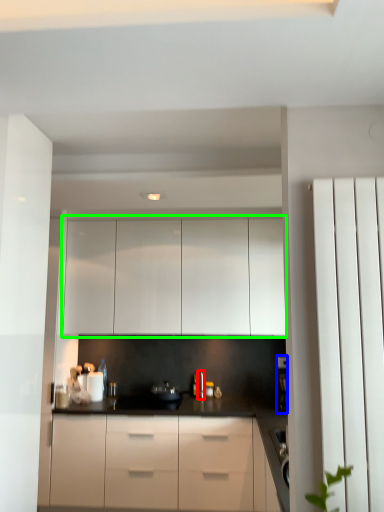
Question: Which is farther away from faucet (highlighted by a red box)? coffee machine (highlighted by a blue box) or cabinetry (highlighted by a green box)?

Choices:
 (A) coffee machine
 (B) cabinetry

Answer: (B)